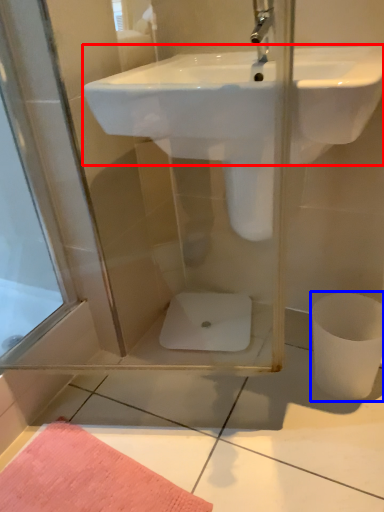
Question: Which point is further to the camera, sink (highlighted by a red box) or toilet bowl (highlighted by a blue box)?

Choices:
 (A) sink
 (B) toilet bowl

Answer: (B)